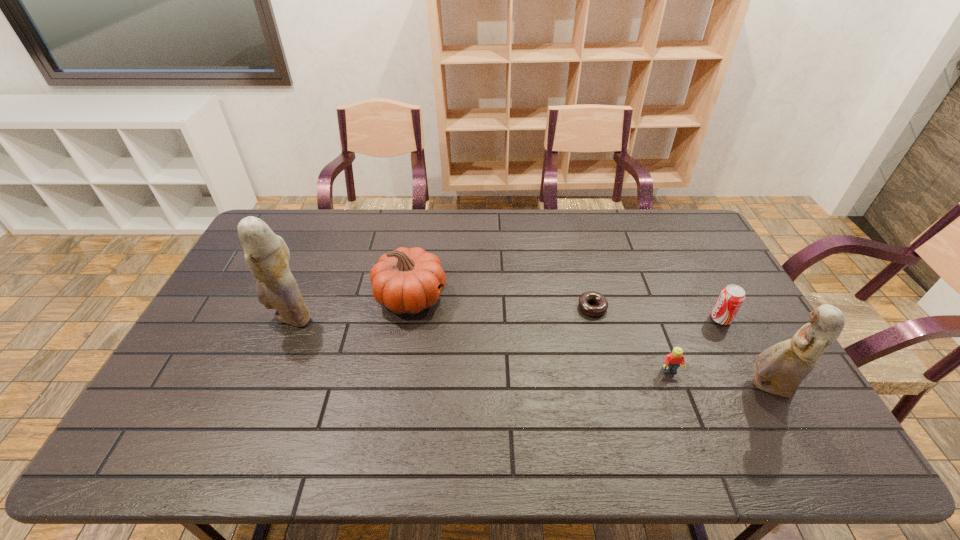
Find the location of a particular element. free space that satisfies the following two spatial constraints: 1. on the logo side of the soda can; 2. on the face of the fifth tallest object is located at coordinates (749, 372).

Find the location of `blank space that satisfies the following two spatial constraints: 1. on the face of the third tallest object; 2. on the right side of the shortest object`. blank space that satisfies the following two spatial constraints: 1. on the face of the third tallest object; 2. on the right side of the shortest object is located at coordinates (409, 308).